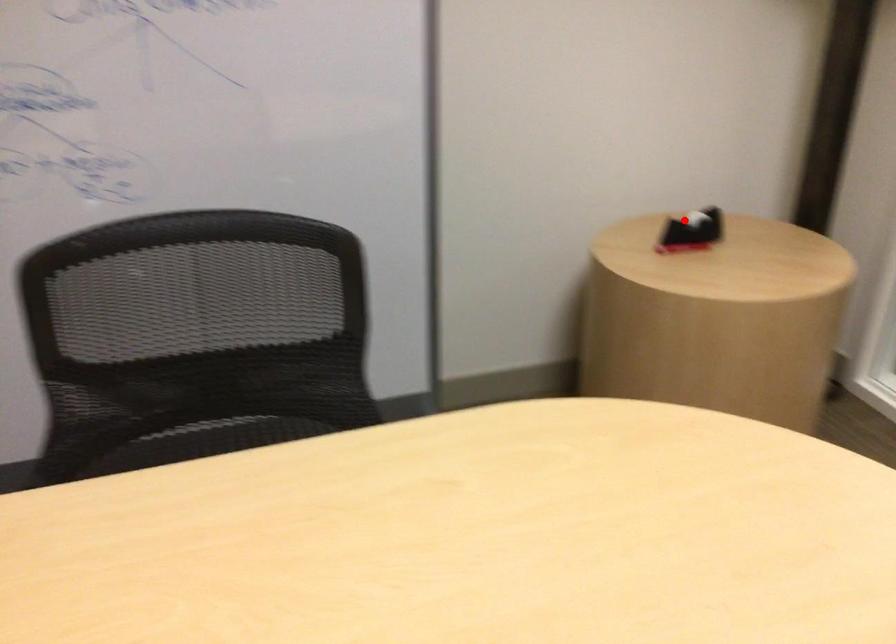
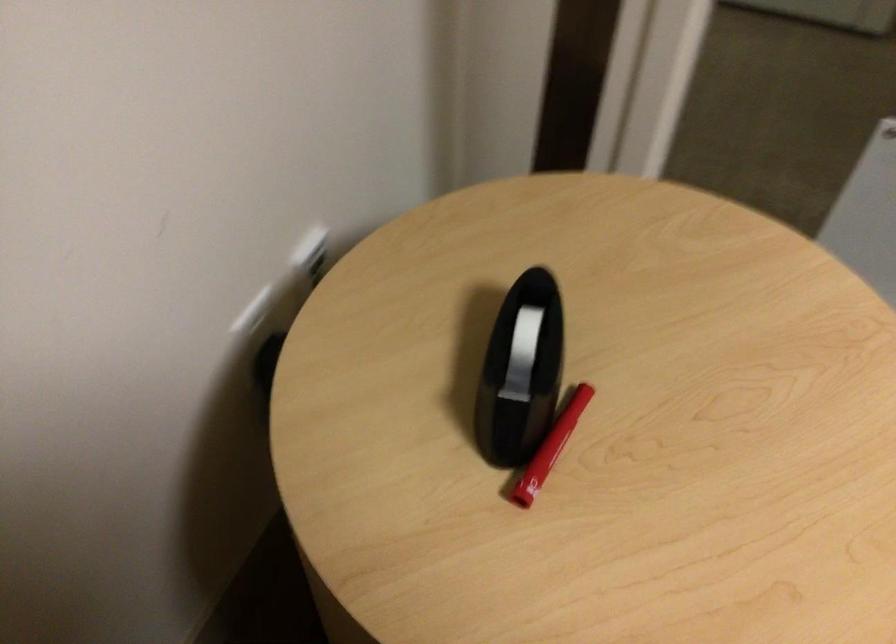
Question: I am providing you with two images of the same scene from different viewpoints. A red point is shown in image1. For the corresponding object point in image2, is it positioned nearer or farther from the camera?

Choices:
 (A) Nearer
 (B) Farther

Answer: (A)